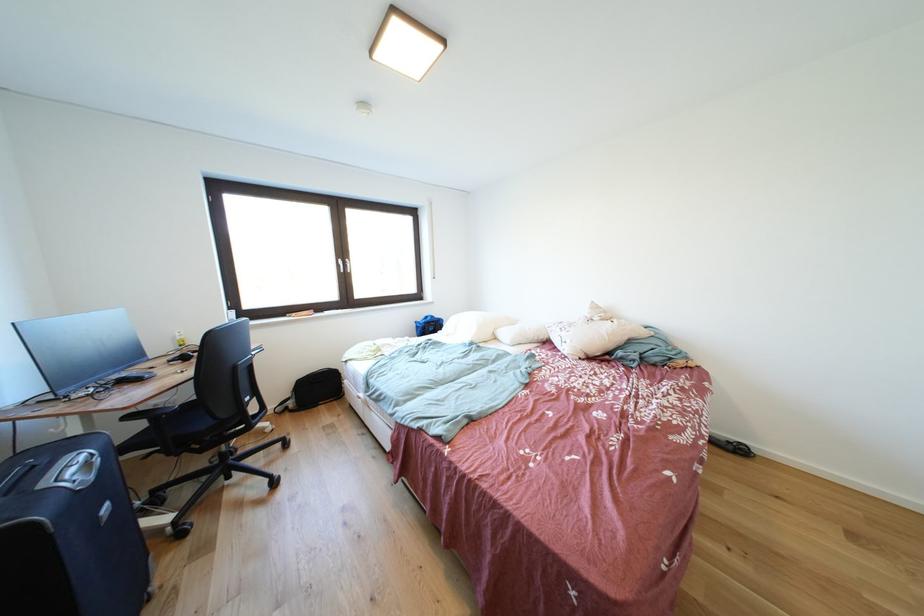
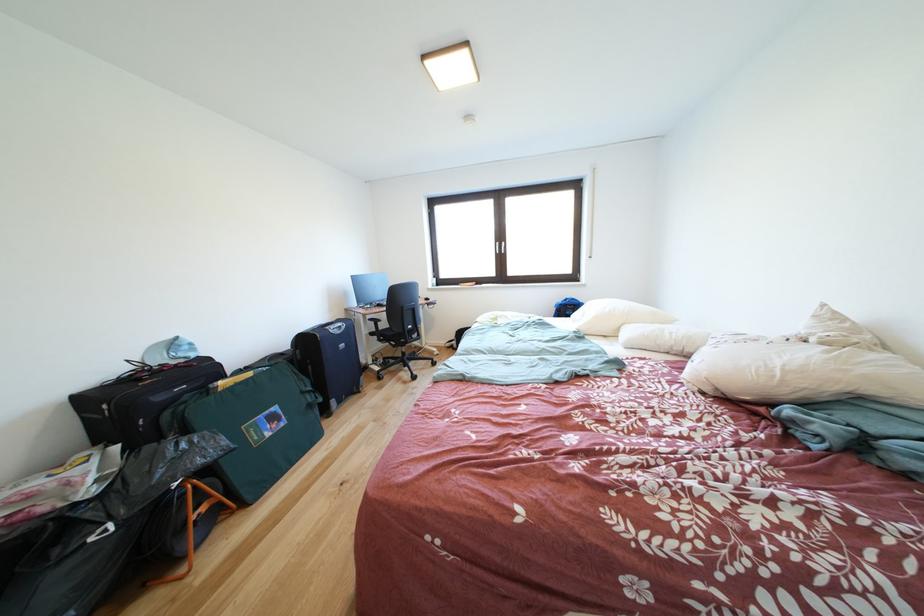
Find the pixel in the second image that matches point (210, 455) in the first image.

(403, 351)